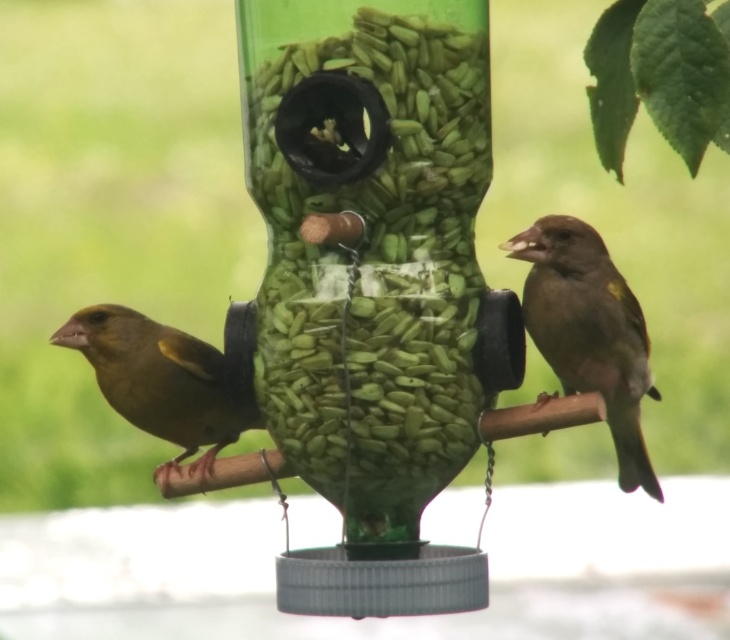
You see a bird feeder shaped like a green parrot with two birds perched on it. There is a brown matte sparrow at right and a green matte bird at left. Which bird is positioned to the right side of the feeder?

The brown matte sparrow at right is positioned to the right side of the feeder, while the green matte bird at left is on the left side.

You are a small bird trying to land on the green plastic bird feeder at center. There is a brown matte sparrow at right already perched there. Considering the size of the feeder compared to the sparrow, can you comfortably land next to the sparrow?

The green plastic bird feeder at center is wider than the brown matte sparrow at right, so there should be enough space for you to land next to the brown matte sparrow at right comfortably.

From the picture: You are standing 5 feet away from the bird feeder. Can you safely reach out to feed the brown matte sparrow at right without disturbing it?

The brown matte sparrow at right is 4.89 feet away from you. Since you are standing 5 feet away from the bird feeder, you are slightly farther than the sparrow, so reaching out might startle it. It is safer to maintain your distance to avoid disturbing the brown matte sparrow at right.